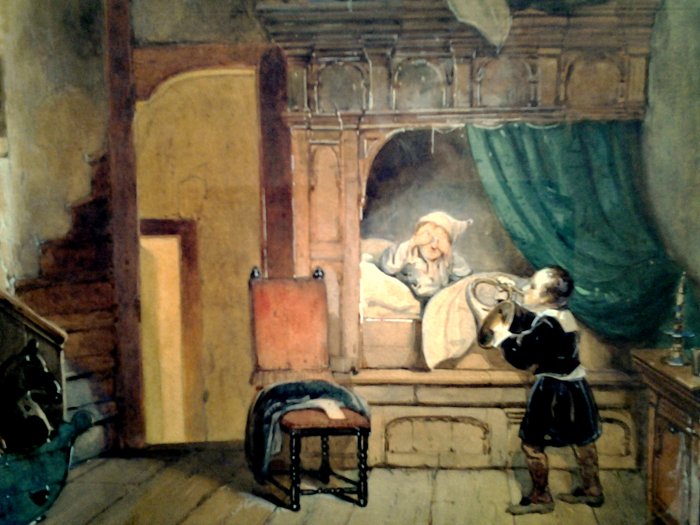
Locate an element on the screen. candle is located at coordinates (675, 321).